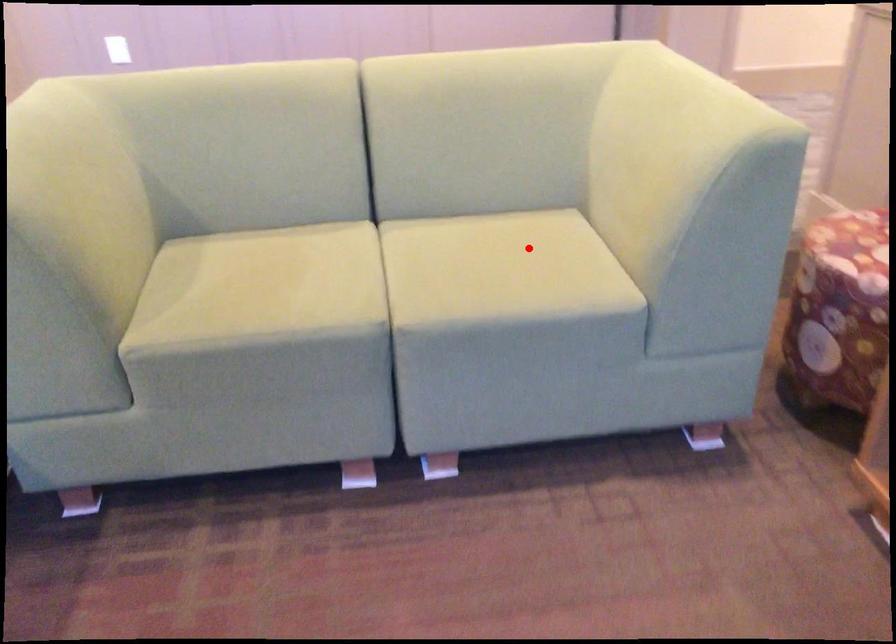
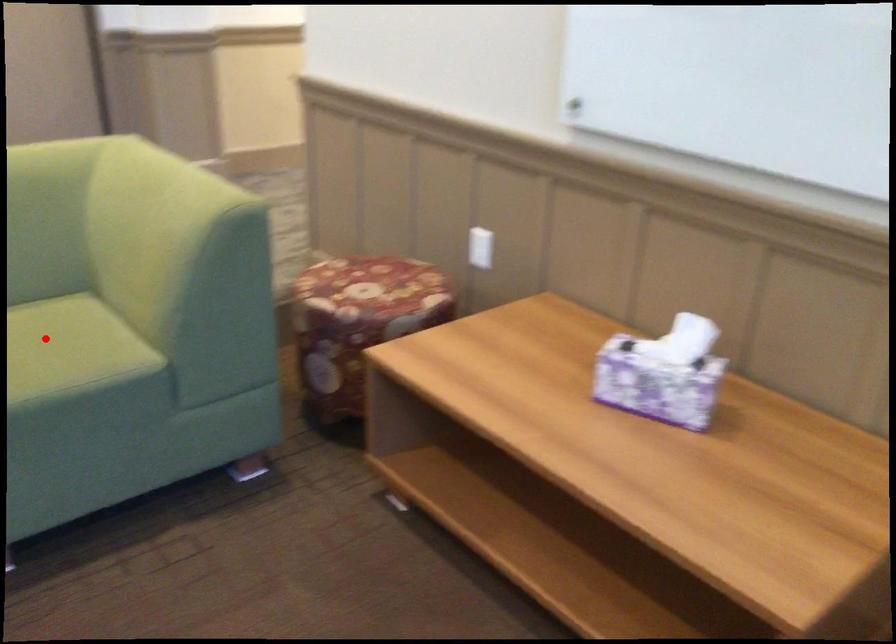
I am providing you with two images of the same scene from different viewpoints. A red point is marked on the first image and another point is marked on the second image. Is the red point in image1 aligned with the point shown in image2?

Yes